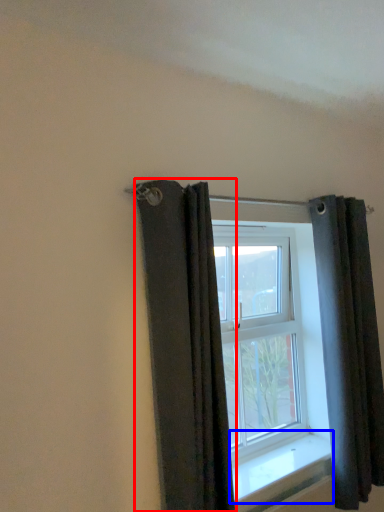
Question: Which point is further to the camera, curtain (highlighted by a red box) or window sill (highlighted by a blue box)?

Choices:
 (A) curtain
 (B) window sill

Answer: (B)